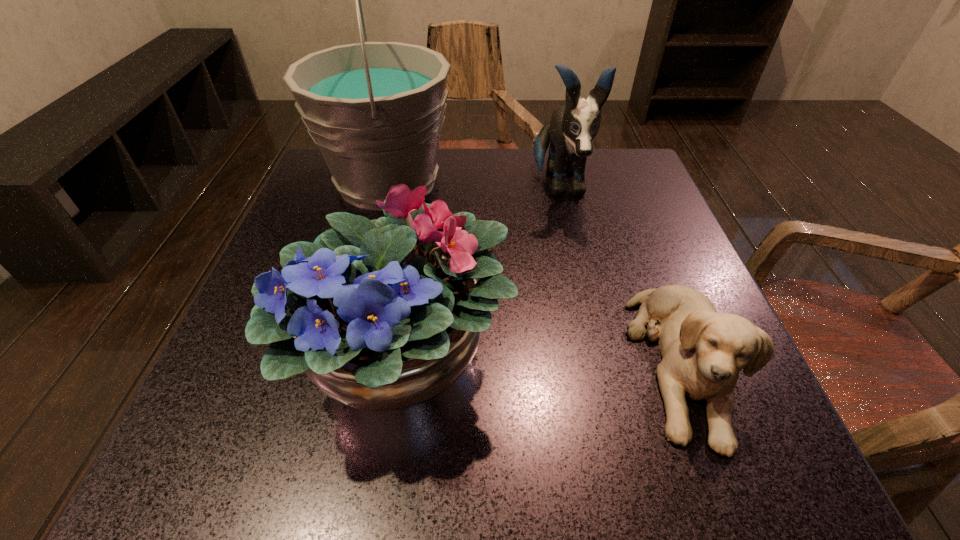
I want to click on the tallest object, so click(x=375, y=110).

Where is `the taller puppy`? the taller puppy is located at coordinates (572, 129).

You are a GUI agent. You are given a task and a screenshot of the screen. Output one action in this format:
    pyautogui.click(x=<x>, y=<y>)
    Task: Click on the bouquet
    Image resolution: width=960 pixels, height=540 pixels.
    Given the screenshot: What is the action you would take?
    pyautogui.click(x=385, y=315)

Where is `the nearer puppy`? Image resolution: width=960 pixels, height=540 pixels. the nearer puppy is located at coordinates (x=703, y=351).

What are the coordinates of `the shortest object` in the screenshot? It's located at (703, 351).

Find the location of a particular element. vacant position located 0.080m on the right of the tallest object is located at coordinates (490, 183).

Find the location of a particular element. The width and height of the screenshot is (960, 540). free space located 0.080m on the front-facing side of the farther puppy is located at coordinates (573, 245).

I want to click on free spot located 0.160m on the back of the bouquet, so click(x=421, y=224).

At what (x,y) coordinates should I click in order to perform the action: click on bucket situated at the far edge. Please return your answer as a coordinate pair (x, y). Looking at the image, I should click on (x=375, y=110).

Find the location of a particular element. puppy that is at the far edge is located at coordinates (572, 129).